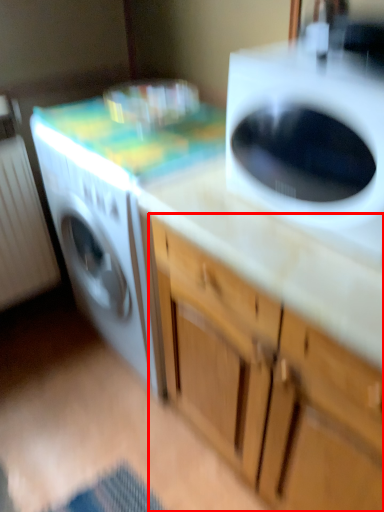
Question: From the image's perspective, what is the correct spatial relationship of cabinetry (annotated by the red box) in relation to washing machine?

Choices:
 (A) below
 (B) above

Answer: (A)